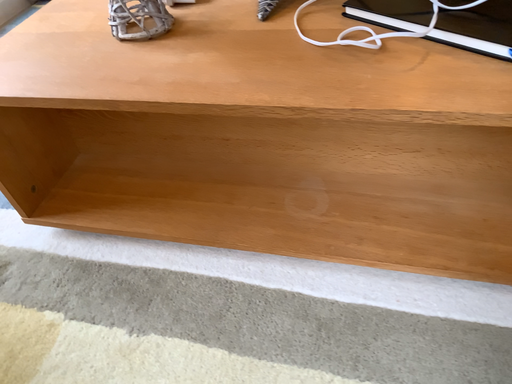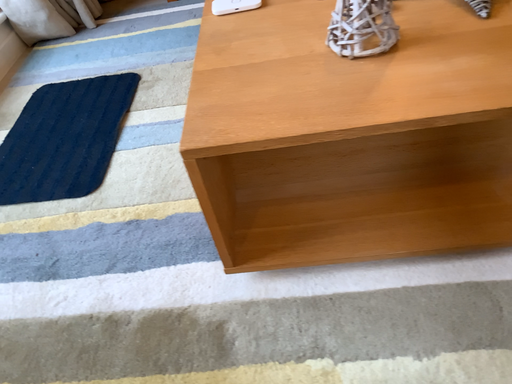
Question: How did the camera likely rotate when shooting the video?

Choices:
 (A) rotated left
 (B) rotated right

Answer: (B)